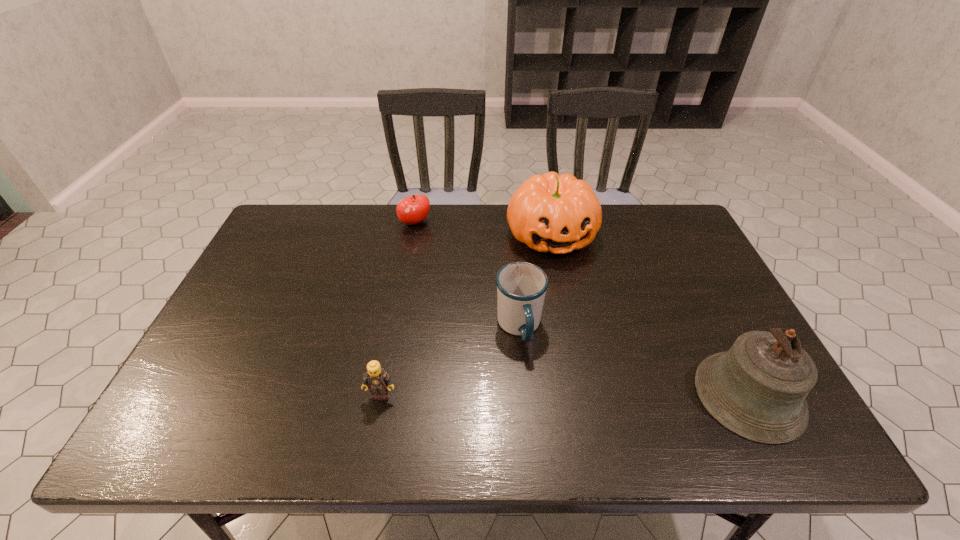
Locate an element on the screen. The image size is (960, 540). free space located 0.120m on the carved face of the pumpkin is located at coordinates (573, 292).

Locate an element on the screen. This screenshot has height=540, width=960. vacant space located on the carved face of the pumpkin is located at coordinates (588, 333).

I want to click on free location located on the handle side of the mug, so click(x=540, y=392).

You are a GUI agent. You are given a task and a screenshot of the screen. Output one action in this format:
    pyautogui.click(x=<x>, y=<y>)
    Task: Click on the apple that is at the far edge
    This screenshot has height=540, width=960.
    Given the screenshot: What is the action you would take?
    pyautogui.click(x=411, y=210)

The width and height of the screenshot is (960, 540). Find the location of `pumpkin situated at the far edge`. pumpkin situated at the far edge is located at coordinates (554, 213).

The image size is (960, 540). I want to click on Lego located at the near edge, so click(378, 381).

You are a GUI agent. You are given a task and a screenshot of the screen. Output one action in this format:
    pyautogui.click(x=<x>, y=<y>)
    Task: Click on the bell present at the near edge
    
    Given the screenshot: What is the action you would take?
    [x=757, y=389]

This screenshot has width=960, height=540. I want to click on object situated at the right edge, so click(757, 389).

This screenshot has height=540, width=960. In order to click on object situated at the near right corner in this screenshot , I will do `click(757, 389)`.

Where is `vacant area at the far edge`? The image size is (960, 540). vacant area at the far edge is located at coordinates (475, 228).